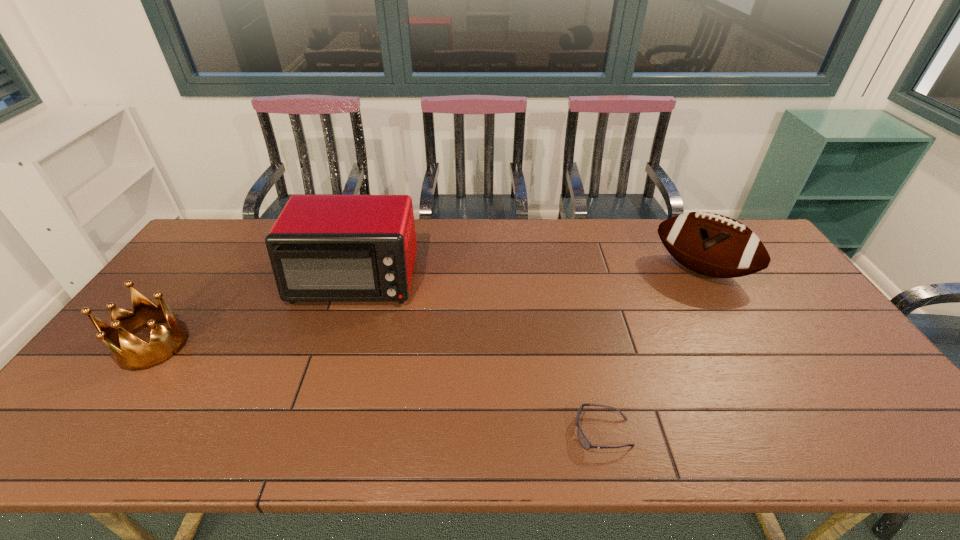
Locate an element on the screen. vacant space at the right edge of the desktop is located at coordinates (872, 400).

Find the location of a particular element. vacant region at the near left corner of the desktop is located at coordinates (66, 422).

Identify the location of vacant space that's between the rightmost object and the toaster oven. (528, 275).

Identify the location of free space that is in between the rightmost object and the third object from right to left. (528, 275).

Find the location of a particular element. free space between the rightmost object and the second object from left to right is located at coordinates (528, 275).

The height and width of the screenshot is (540, 960). Identify the location of vacant space that's between the crown and the third object from left to right. (378, 388).

At what (x,y) coordinates should I click in order to perform the action: click on free space between the third object from right to left and the football (American). Please return your answer as a coordinate pair (x, y). This screenshot has width=960, height=540. Looking at the image, I should click on (528, 275).

Locate an element on the screen. The image size is (960, 540). vacant space that's between the second object from left to right and the football (American) is located at coordinates (528, 275).

This screenshot has width=960, height=540. Find the location of `free spot between the third object from right to left and the second nearest object`. free spot between the third object from right to left and the second nearest object is located at coordinates (253, 313).

Find the location of `free spot between the rightmost object and the nearest object`. free spot between the rightmost object and the nearest object is located at coordinates (652, 351).